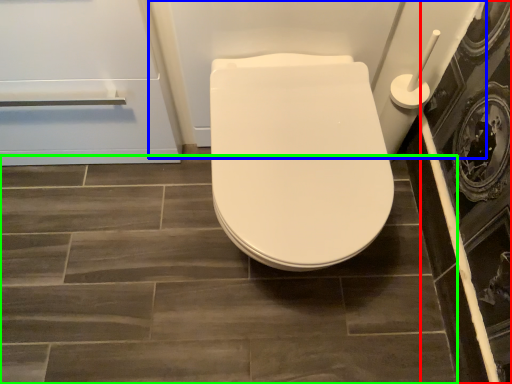
Question: Considering the real-world distances, which object is farthest from screen door (highlighted by a red box)? bath (highlighted by a blue box) or ceramic tile (highlighted by a green box)?

Choices:
 (A) bath
 (B) ceramic tile

Answer: (B)